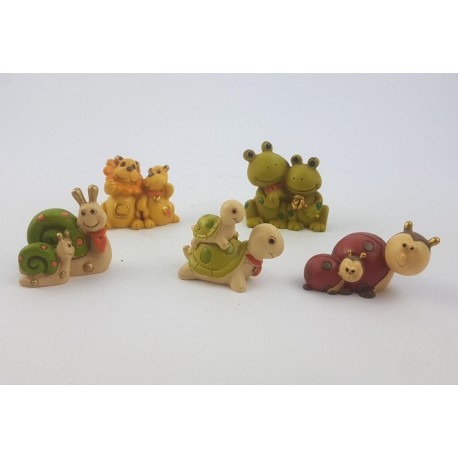
Where is `figurines`? figurines is located at coordinates (61, 233), (143, 205), (295, 184), (224, 256), (376, 258).